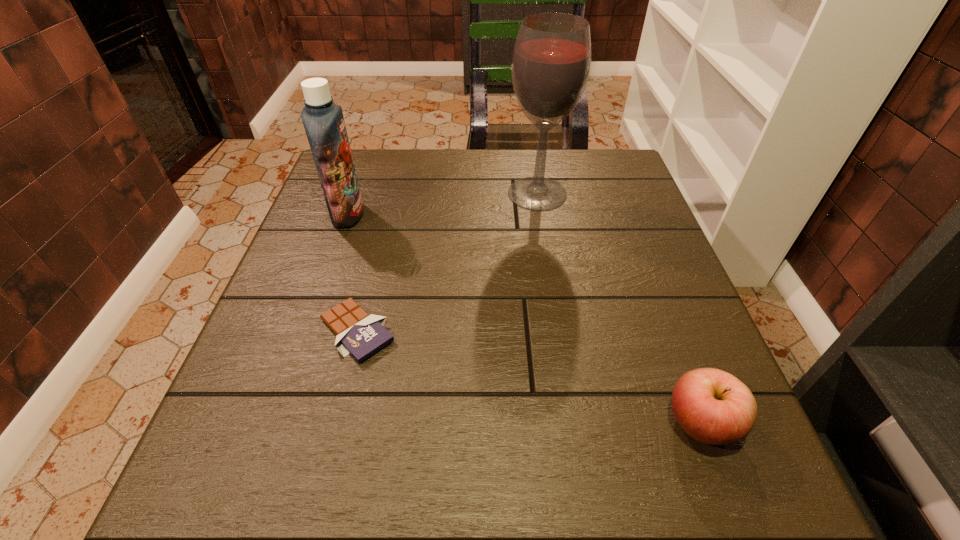
The image size is (960, 540). I want to click on vacant area situated on the right of the shortest object, so click(539, 331).

Locate an element on the screen. object that is at the far edge is located at coordinates (551, 63).

Locate an element on the screen. This screenshot has height=540, width=960. shampoo that is positioned at the left edge is located at coordinates (323, 120).

Where is `chocolate bar located in the left edge section of the desktop`? Image resolution: width=960 pixels, height=540 pixels. chocolate bar located in the left edge section of the desktop is located at coordinates (361, 335).

Locate an element on the screen. This screenshot has height=540, width=960. object located at the right edge is located at coordinates (712, 406).

The image size is (960, 540). In the image, there is a desktop. Find the location of `vacant space at the far edge`. vacant space at the far edge is located at coordinates (532, 148).

The height and width of the screenshot is (540, 960). Find the location of `free space at the near edge of the desktop`. free space at the near edge of the desktop is located at coordinates (342, 520).

The image size is (960, 540). What are the coordinates of `vacant area at the left edge` in the screenshot? It's located at (329, 261).

Identify the location of vacant region at the right edge of the desktop. The image size is (960, 540). (612, 282).

This screenshot has height=540, width=960. Find the location of `free space at the far left corner`. free space at the far left corner is located at coordinates (372, 158).